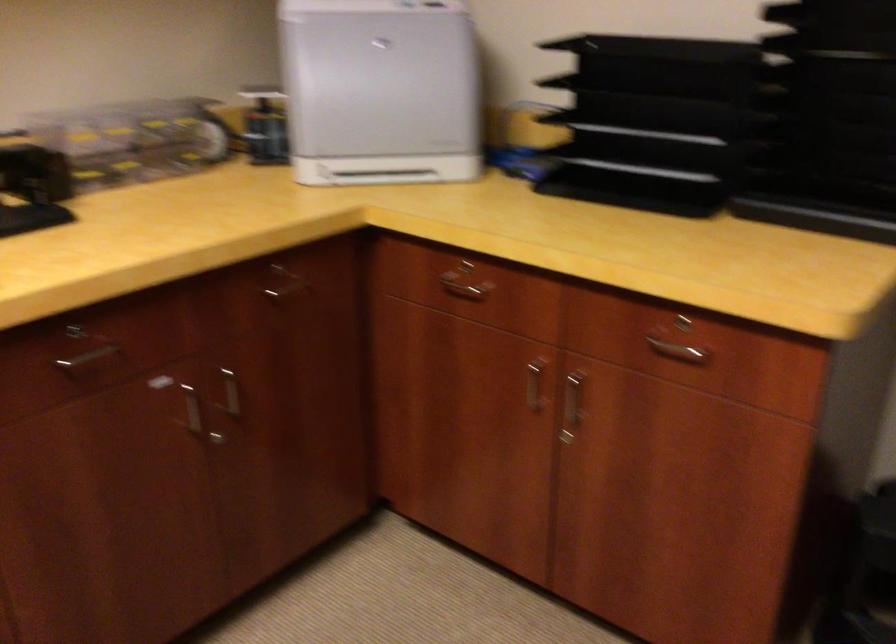
Where is `printer paper slot`? This screenshot has height=644, width=896. printer paper slot is located at coordinates (380, 176).